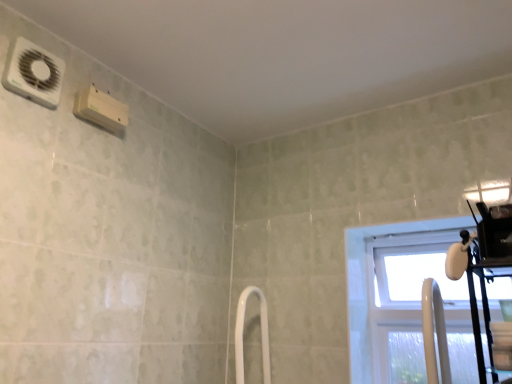
What is the approximate width of transparent plastic window at right?

It is 5.73 inches.

Where is `white plastic air conditioning unit at upper left`? This screenshot has width=512, height=384. white plastic air conditioning unit at upper left is located at coordinates (33, 73).

Where is `transparent plastic window at right`? transparent plastic window at right is located at coordinates (372, 282).

Is transparent plastic window at right oriented towards white plastic air conditioning unit at upper left?

No, transparent plastic window at right is not turned towards white plastic air conditioning unit at upper left.

Considering the sizes of objects transparent plastic window at right and white plastic air conditioning unit at upper left in the image provided, who is smaller, transparent plastic window at right or white plastic air conditioning unit at upper left?

white plastic air conditioning unit at upper left is smaller.

Is transparent plastic window at right not close to white plastic air conditioning unit at upper left?

transparent plastic window at right is positioned a significant distance from white plastic air conditioning unit at upper left.

What are the coordinates of `window located underneath the white plastic air conditioning unit at upper left (from a real-world perspective)` in the screenshot? It's located at (372, 282).

Between white glossy shower door at center and white plastic air conditioning unit at upper left, which one has larger size?

white glossy shower door at center is bigger.

Is white glossy shower door at center thinner than white plastic air conditioning unit at upper left?

In fact, white glossy shower door at center might be wider than white plastic air conditioning unit at upper left.

You are a GUI agent. You are given a task and a screenshot of the screen. Output one action in this format:
    pyautogui.click(x=<x>, y=<y>)
    Task: Click on the air conditioning that is above the white glossy shower door at center (from a real-world perspective)
    
    Given the screenshot: What is the action you would take?
    pyautogui.click(x=33, y=73)

From a real-world perspective, is white glossy shower door at center positioned above or below white plastic air conditioning unit at upper left?

From a real-world perspective, white glossy shower door at center is physically below white plastic air conditioning unit at upper left.

From the image's perspective, is white plastic air conditioning unit at upper left beneath white glossy shower door at center?

Incorrect, from the image's perspective, white plastic air conditioning unit at upper left is higher than white glossy shower door at center.

From a real-world perspective, relative to white glossy shower door at center, is white plastic air conditioning unit at upper left vertically above or below?

Clearly, from a real-world perspective, white plastic air conditioning unit at upper left is above white glossy shower door at center.

How much distance is there between white plastic air conditioning unit at upper left and white glossy shower door at center?

white plastic air conditioning unit at upper left and white glossy shower door at center are 99.11 centimeters apart.

Considering the sizes of objects white plastic air conditioning unit at upper left and white glossy shower door at center in the image provided, who is taller, white plastic air conditioning unit at upper left or white glossy shower door at center?

white glossy shower door at center.

Is white plastic air conditioning unit at upper left not close to transparent plastic window at right?

white plastic air conditioning unit at upper left is far away from transparent plastic window at right.

Which object is wider, white plastic air conditioning unit at upper left or transparent plastic window at right?

Wider between the two is transparent plastic window at right.

From a real-world perspective, which object stands above the other?

white plastic air conditioning unit at upper left, from a real-world perspective.

Between white plastic air conditioning unit at upper left and transparent plastic window at right, which one has more height?

transparent plastic window at right.

Is white glossy shower door at center inside the boundaries of transparent plastic window at right, or outside?

white glossy shower door at center cannot be found inside transparent plastic window at right.

Looking at this image, from a real-world perspective, is white glossy shower door at center beneath transparent plastic window at right?

Correct, in the physical world, white glossy shower door at center is lower than transparent plastic window at right.

Is white glossy shower door at center wider than transparent plastic window at right?

Yes.

Is transparent plastic window at right directly adjacent to white glossy shower door at center?

No, transparent plastic window at right is not with white glossy shower door at center.

Considering the relative positions of transparent plastic window at right and white glossy shower door at center in the image provided, is transparent plastic window at right to the right of white glossy shower door at center from the viewer's perspective?

Correct, you'll find transparent plastic window at right to the right of white glossy shower door at center.

Which of these two, transparent plastic window at right or white glossy shower door at center, is wider?

With larger width is white glossy shower door at center.

Identify the location of window that appears on the right of white plastic air conditioning unit at upper left. The height and width of the screenshot is (384, 512). (372, 282).

In order to click on air conditioning on the left of white glossy shower door at center in this screenshot , I will do `click(33, 73)`.

In the scene shown: Estimate the real-world distances between objects in this image. Which object is closer to white glossy shower door at center, transparent plastic window at right or white plastic air conditioning unit at upper left?

The object closer to white glossy shower door at center is transparent plastic window at right.

When comparing their distances from white plastic air conditioning unit at upper left, does transparent plastic window at right or white glossy shower door at center seem closer?

The object closer to white plastic air conditioning unit at upper left is white glossy shower door at center.

Based on their spatial positions, is white glossy shower door at center or transparent plastic window at right closer to white plastic air conditioning unit at upper left?

white glossy shower door at center.

When comparing their distances from white glossy shower door at center, does white plastic air conditioning unit at upper left or transparent plastic window at right seem closer?

Among the two, transparent plastic window at right is located nearer to white glossy shower door at center.

Considering their positions, is white glossy shower door at center positioned further to transparent plastic window at right than white plastic air conditioning unit at upper left?

The object further to transparent plastic window at right is white plastic air conditioning unit at upper left.

When comparing their distances from transparent plastic window at right, does white plastic air conditioning unit at upper left or white glossy shower door at center seem further?

white plastic air conditioning unit at upper left lies further to transparent plastic window at right than the other object.

The width and height of the screenshot is (512, 384). I want to click on shower door between white plastic air conditioning unit at upper left and transparent plastic window at right, so click(243, 332).